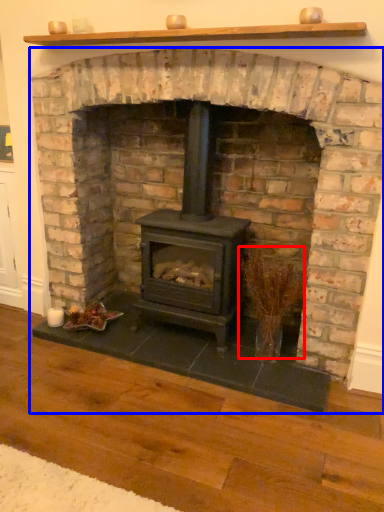
Question: Which object is further to the camera taking this photo, twig (highlighted by a red box) or fireplace (highlighted by a blue box)?

Choices:
 (A) twig
 (B) fireplace

Answer: (A)